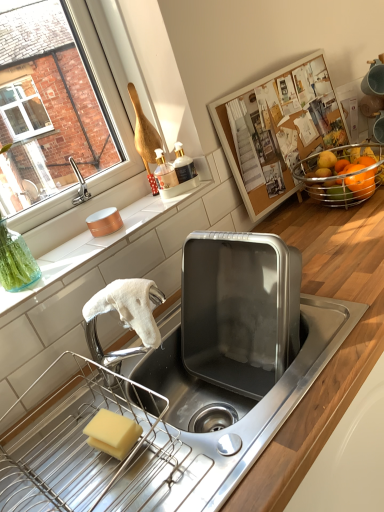
Question: From a real-world perspective, is yellow sponge at lower left physically above orange matte at right?

Choices:
 (A) yes
 (B) no

Answer: (B)

Question: Can you confirm if yellow sponge at lower left is bigger than orange matte at right?

Choices:
 (A) yes
 (B) no

Answer: (B)

Question: Is yellow sponge at lower left at the right side of orange matte at right?

Choices:
 (A) yes
 (B) no

Answer: (B)

Question: Is yellow sponge at lower left wider than orange matte at right?

Choices:
 (A) yes
 (B) no

Answer: (A)

Question: Is yellow sponge at lower left outside of orange matte at right?

Choices:
 (A) no
 (B) yes

Answer: (B)

Question: Looking at the image, does orange matte at right seem bigger or smaller compared to white matte towel at left, which is the 1th countertop in top-to-bottom order?

Choices:
 (A) big
 (B) small

Answer: (B)

Question: Is orange matte at right spatially inside white matte towel at left, which is the 1th countertop in top-to-bottom order, or outside of it?

Choices:
 (A) outside
 (B) inside

Answer: (A)

Question: Considering the positions of orange matte at right and white matte towel at left, which is counted as the 2th countertop, starting from the bottom, in the image, is orange matte at right wider or thinner than white matte towel at left, which is counted as the 2th countertop, starting from the bottom,?

Choices:
 (A) wide
 (B) thin

Answer: (B)

Question: Considering the relative positions of orange matte at right and white matte towel at left, which is the 1th countertop in top-to-bottom order, in the image provided, is orange matte at right to the left or to the right of white matte towel at left, which is the 1th countertop in top-to-bottom order,?

Choices:
 (A) right
 (B) left

Answer: (A)

Question: Is yellow sponge at lower left taller or shorter than orange matte at right?

Choices:
 (A) tall
 (B) short

Answer: (B)

Question: Is yellow sponge at lower left in front of or behind orange matte at right in the image?

Choices:
 (A) behind
 (B) front

Answer: (B)

Question: In terms of size, does yellow sponge at lower left appear bigger or smaller than orange matte at right?

Choices:
 (A) small
 (B) big

Answer: (A)

Question: Would you say yellow sponge at lower left is inside or outside orange matte at right?

Choices:
 (A) outside
 (B) inside

Answer: (A)

Question: From a real-world perspective, is shiny orange fruit at upper right above or below yellow sponge at lower left?

Choices:
 (A) below
 (B) above

Answer: (B)

Question: Is shiny orange fruit at upper right taller or shorter than yellow sponge at lower left?

Choices:
 (A) short
 (B) tall

Answer: (B)